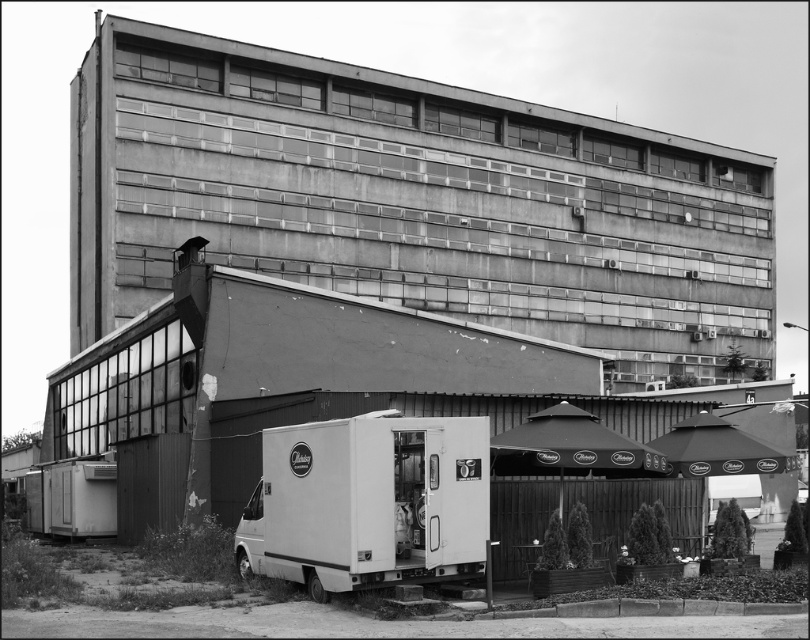
Question: Among these objects, which one is nearest to the camera?

Choices:
 (A) white matte food truck at lower center
 (B) metallic trailer at lower left

Answer: (A)

Question: In this image, where is white matte food truck at lower center located relative to metallic trailer at lower left?

Choices:
 (A) below
 (B) above

Answer: (B)

Question: Is white matte food truck at lower center positioned at the back of metallic trailer at lower left?

Choices:
 (A) yes
 (B) no

Answer: (B)

Question: In this image, where is white matte food truck at lower center located relative to metallic trailer at lower left?

Choices:
 (A) above
 (B) below

Answer: (A)